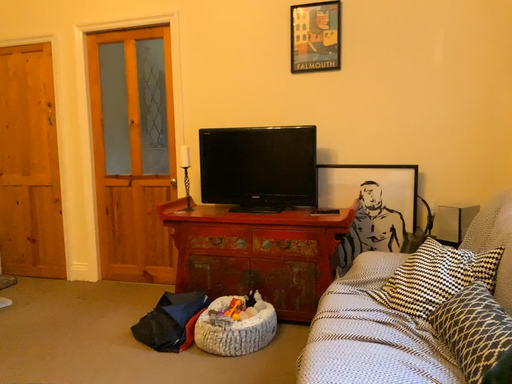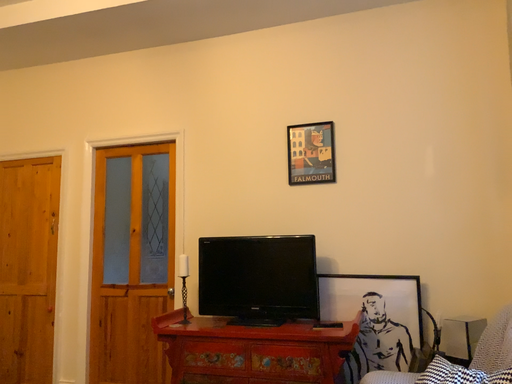
Question: Which way did the camera rotate in the video?

Choices:
 (A) rotated upward
 (B) rotated downward

Answer: (A)